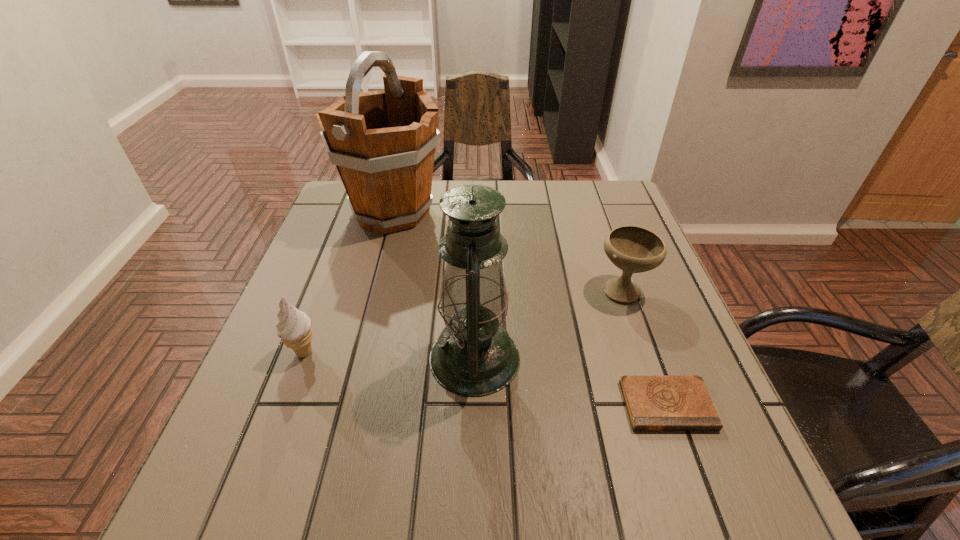
Find the location of a particular element. bucket is located at coordinates (383, 142).

Locate an element on the screen. the third object from left to right is located at coordinates (474, 356).

This screenshot has height=540, width=960. I want to click on icecream, so click(294, 327).

Locate an element on the screen. The width and height of the screenshot is (960, 540). the fourth nearest object is located at coordinates (633, 249).

I want to click on diary, so click(x=654, y=402).

Identify the location of vacant area situated 0.170m on the front of the farthest object. The width and height of the screenshot is (960, 540). (372, 289).

You are a GUI agent. You are given a task and a screenshot of the screen. Output one action in this format:
    pyautogui.click(x=<x>, y=<y>)
    Task: Click on the free point located 0.160m on the back of the third object from left to right
    
    Given the screenshot: What is the action you would take?
    pyautogui.click(x=475, y=272)

Find the location of a particular element. The height and width of the screenshot is (540, 960). free space located on the front-facing side of the icecream is located at coordinates (391, 352).

I want to click on free space located on the front of the second farthest object, so click(x=657, y=386).

At what (x,y) coordinates should I click in order to perform the action: click on free region located on the spine side of the diary. Please return your answer as a coordinate pair (x, y). Looking at the image, I should click on (700, 498).